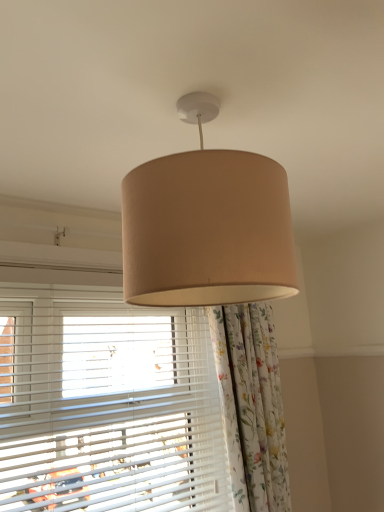
Question: Would you say beige fabric lampshade at center is to the left or to the right of white matte blinds at lower left in the picture?

Choices:
 (A) right
 (B) left

Answer: (A)

Question: Choose the correct answer: Is beige fabric lampshade at center inside white matte blinds at lower left or outside it?

Choices:
 (A) inside
 (B) outside

Answer: (B)

Question: From a real-world perspective, relative to white matte blinds at lower left, is beige fabric lampshade at center vertically above or below?

Choices:
 (A) below
 (B) above

Answer: (B)

Question: From the image's perspective, is white matte blinds at lower left positioned above or below beige fabric lampshade at center?

Choices:
 (A) below
 (B) above

Answer: (A)

Question: Based on their sizes in the image, would you say white matte blinds at lower left is bigger or smaller than beige fabric lampshade at center?

Choices:
 (A) big
 (B) small

Answer: (A)

Question: Is white matte blinds at lower left inside or outside of beige fabric lampshade at center?

Choices:
 (A) outside
 (B) inside

Answer: (A)

Question: Would you say white matte blinds at lower left is to the left or to the right of beige fabric lampshade at center in the picture?

Choices:
 (A) left
 (B) right

Answer: (A)